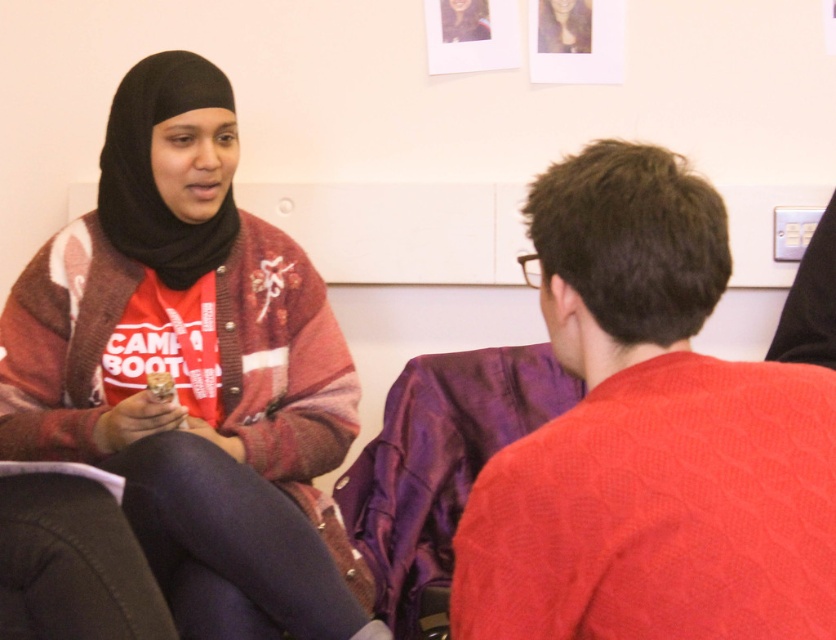
Question: Is red sweater at right closer to the viewer compared to matte brown cookie at center?

Choices:
 (A) no
 (B) yes

Answer: (B)

Question: Is red sweater at right wider than matte black hijab at upper left?

Choices:
 (A) no
 (B) yes

Answer: (B)

Question: Which point appears closest to the camera in this image?

Choices:
 (A) (600, 384)
 (B) (166, 380)
 (C) (441, 544)

Answer: (A)

Question: Which of the following is the farthest from the observer?

Choices:
 (A) matte black hijab at upper left
 (B) matte red cardigan at left
 (C) red sweater at right
 (D) purple satin shawl at center

Answer: (D)

Question: Which object appears farthest from the camera in this image?

Choices:
 (A) matte brown cookie at center
 (B) matte red cardigan at left
 (C) purple satin shawl at center
 (D) red sweater at right

Answer: (C)

Question: Is red sweater at right in front of matte brown cookie at center?

Choices:
 (A) yes
 (B) no

Answer: (A)